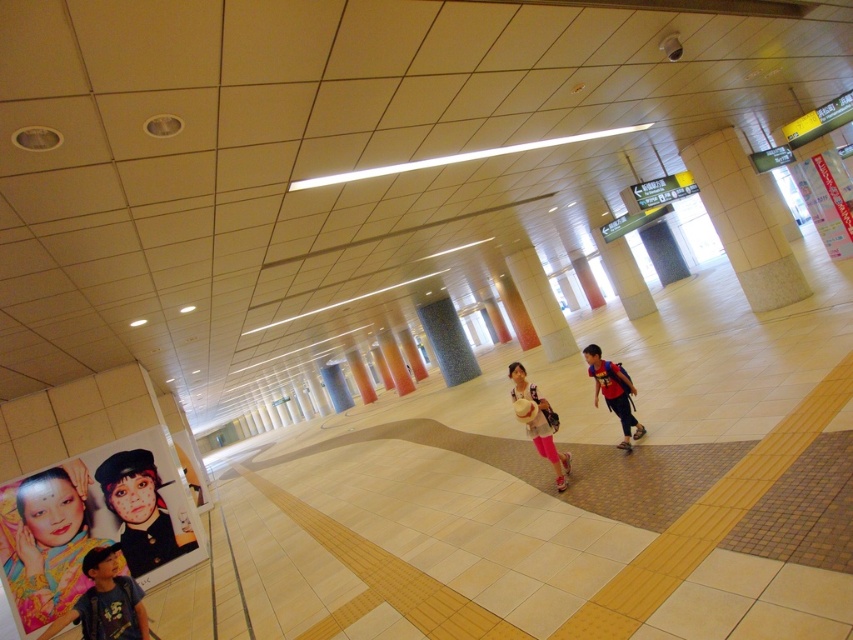
You are a traveler who just entered the station and see the colorful paper poster at lower left and the matte black hat at lower left. Which object is wider?

The colorful paper poster at lower left is wider than the matte black hat at lower left.